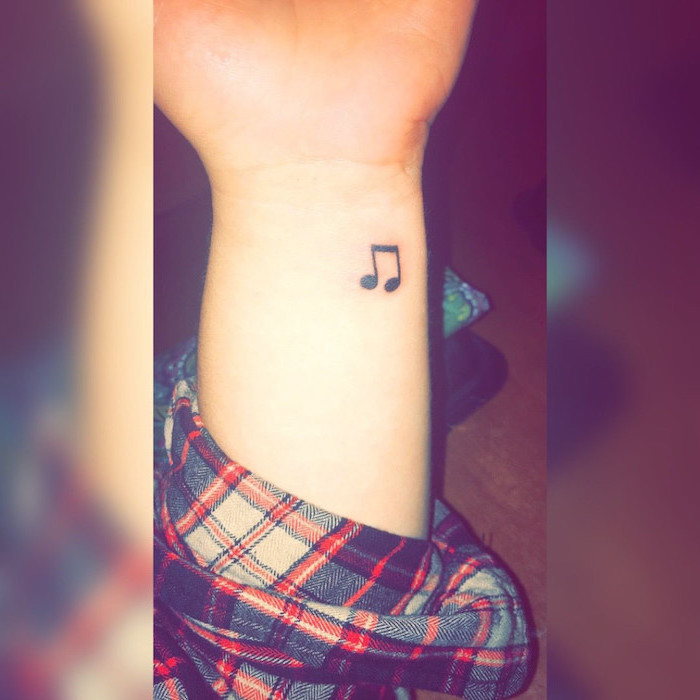
Find the location of a particular element. corner of table is located at coordinates (456, 300).